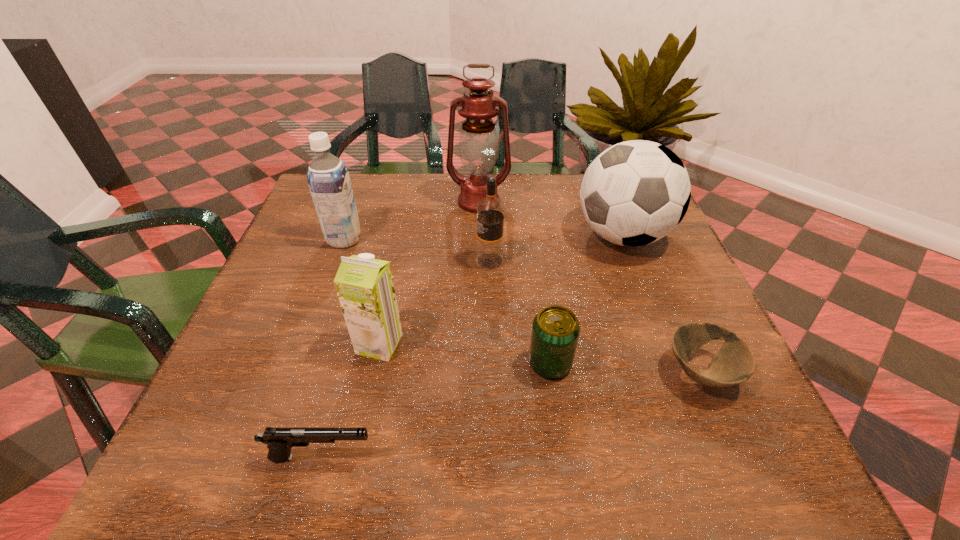
You are a GUI agent. You are given a task and a screenshot of the screen. Output one action in this format:
    pyautogui.click(x=<x>, y=<y>)
    Task: Click on the bowl situated at the right edge
    
    Given the screenshot: What is the action you would take?
    pyautogui.click(x=734, y=363)

Locate an element on the screen. object that is at the near left corner is located at coordinates (279, 440).

Locate an element on the screen. object present at the far right corner is located at coordinates pyautogui.click(x=634, y=193).

In the image, there is a desktop. At what (x,y) coordinates should I click in order to perform the action: click on vacant area at the far edge. Please return your answer as a coordinate pair (x, y). Image resolution: width=960 pixels, height=540 pixels. Looking at the image, I should click on (510, 173).

This screenshot has height=540, width=960. What are the coordinates of `vacant position at the near edge of the desktop` in the screenshot? It's located at (318, 427).

In the image, there is a desktop. Where is `vacant space at the left edge`? The width and height of the screenshot is (960, 540). vacant space at the left edge is located at coordinates (286, 352).

Find the location of a particular element. Image resolution: width=960 pixels, height=540 pixels. blank space at the right edge of the desktop is located at coordinates (655, 384).

Identify the location of vacant space at the far left corner of the desktop. This screenshot has width=960, height=540. (302, 213).

This screenshot has width=960, height=540. I want to click on blank space at the near right corner of the desktop, so click(762, 463).

Where is `blank region between the shortest object and the taller soya milk`? This screenshot has width=960, height=540. blank region between the shortest object and the taller soya milk is located at coordinates (522, 306).